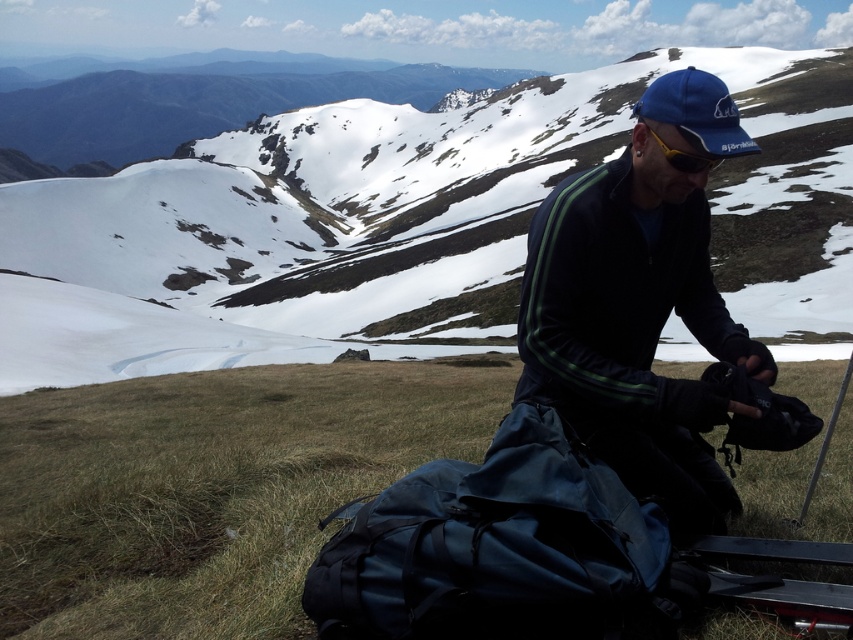
Question: Can you confirm if dark blue fleece jacket at center is positioned above yellow matte/glossy goggles at center?

Choices:
 (A) no
 (B) yes

Answer: (A)

Question: Which point is farther to the camera?

Choices:
 (A) snowy mountain at upper center
 (B) dark blue fleece jacket at center
 (C) yellow matte/glossy goggles at center

Answer: (A)

Question: Which of these objects is positioned closest to the yellow matte/glossy goggles at center?

Choices:
 (A) dark blue fleece jacket at center
 (B) snowy mountain at upper center

Answer: (A)

Question: Which point appears closest to the camera in this image?

Choices:
 (A) (672, 164)
 (B) (703, 108)

Answer: (B)

Question: Does dark blue fleece jacket at center appear on the left side of yellow matte/glossy goggles at center?

Choices:
 (A) no
 (B) yes

Answer: (A)

Question: Can you confirm if snowy mountain at upper center is wider than yellow matte/glossy goggles at center?

Choices:
 (A) yes
 (B) no

Answer: (A)